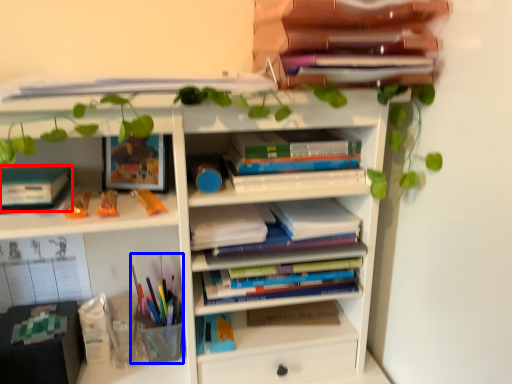
Question: Which point is closer to the camera, paperback book (highlighted by a red box) or stationery (highlighted by a blue box)?

Choices:
 (A) paperback book
 (B) stationery

Answer: (A)